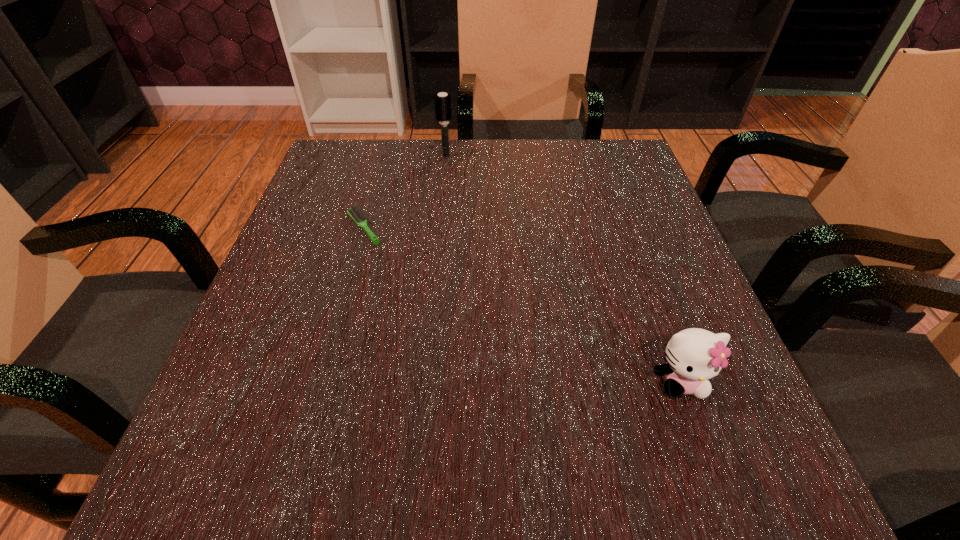
This screenshot has height=540, width=960. Identify the location of object located in the left edge section of the desktop. (357, 215).

Where is `object positioned at the right edge`? This screenshot has height=540, width=960. object positioned at the right edge is located at coordinates (694, 355).

This screenshot has width=960, height=540. Find the location of `vacant point at the far edge`. vacant point at the far edge is located at coordinates (517, 192).

You are a GUI agent. You are given a task and a screenshot of the screen. Output one action in this format:
    pyautogui.click(x=<x>, y=<y>)
    Task: Click on the free space at the near edge
    
    Given the screenshot: What is the action you would take?
    pyautogui.click(x=639, y=507)

Find the location of a particular element. free point at the left edge is located at coordinates (285, 266).

Find the location of a particular element. The height and width of the screenshot is (540, 960). vacant region at the right edge is located at coordinates (660, 299).

In the image, there is a desktop. Find the location of `free space at the far right corner`. free space at the far right corner is located at coordinates (591, 156).

Where is `vacant area that lies between the taller hairbrush and the rightmost object`? The image size is (960, 540). vacant area that lies between the taller hairbrush and the rightmost object is located at coordinates (564, 268).

Locate an element on the screen. free space between the taller hairbrush and the rightmost object is located at coordinates (564, 268).

Find the location of `vacant point located between the leftmost object and the second shortest object`. vacant point located between the leftmost object and the second shortest object is located at coordinates (522, 305).